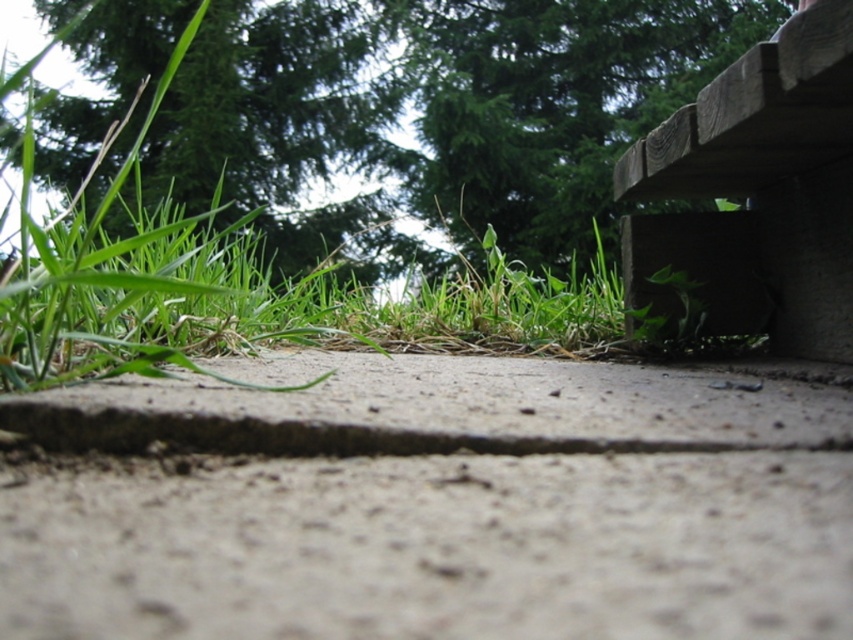
You are sitting on the wooden bench at upper right and want to look at the green leafy tree at upper center. Which direction should you turn your head to see it?

You should turn your head to the left to see the green leafy tree at upper center because it is located to the left of the wooden bench at upper right.

Looking at this image, you are standing on the gray concrete at center and want to sit on the wooden bench at upper right. Which object is lower in height so you can step onto it easily?

The gray concrete at center is shorter than the wooden bench at upper right, so you can step onto it easily.

You are a gardener who wants to place a 12 inch long garden hose between the gray concrete at center and the grass blades on the left. Is there enough space for the garden hose?

The distance between the gray concrete at center and the grass blades on the left is 10.75 inches. Since the garden hose is 12 inches long, it would not fit in the available space.